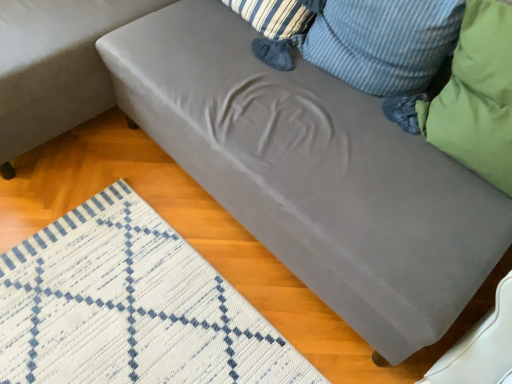
Question: Should I look upward or downward to see green fabric pillow at upper right, positioned as the second pillow in right-to-left order?

Choices:
 (A) up
 (B) down

Answer: (A)

Question: Is green fabric pillow at upper right, positioned as the second pillow in right-to-left order, to the right of satin gray couch at lower right from the viewer's perspective?

Choices:
 (A) yes
 (B) no

Answer: (A)

Question: From a real-world perspective, is green fabric pillow at upper right, acting as the 1th pillow starting from the left, over satin gray couch at lower right?

Choices:
 (A) no
 (B) yes

Answer: (B)

Question: Considering the relative sizes of green fabric pillow at upper right, acting as the 1th pillow starting from the left, and satin gray couch at lower right in the image provided, is green fabric pillow at upper right, acting as the 1th pillow starting from the left, smaller than satin gray couch at lower right?

Choices:
 (A) yes
 (B) no

Answer: (A)

Question: Is green fabric pillow at upper right, acting as the 1th pillow starting from the left, thinner than satin gray couch at lower right?

Choices:
 (A) no
 (B) yes

Answer: (B)

Question: From the image's perspective, is green fabric pillow at upper right, acting as the 1th pillow starting from the left, located above satin gray couch at lower right?

Choices:
 (A) yes
 (B) no

Answer: (B)

Question: Is satin gray couch at lower right at the back of green fabric pillow at upper right, positioned as the second pillow in right-to-left order?

Choices:
 (A) no
 (B) yes

Answer: (A)

Question: Considering the relative sizes of satin gray couch at lower right and green fabric pillow at upper right, positioned as the second pillow in right-to-left order, in the image provided, is satin gray couch at lower right smaller than green fabric pillow at upper right, positioned as the second pillow in right-to-left order,?

Choices:
 (A) no
 (B) yes

Answer: (A)

Question: From a real-world perspective, is satin gray couch at lower right beneath green fabric pillow at upper right, acting as the 1th pillow starting from the left?

Choices:
 (A) no
 (B) yes

Answer: (B)

Question: Is satin gray couch at lower right not inside green fabric pillow at upper right, acting as the 1th pillow starting from the left?

Choices:
 (A) yes
 (B) no

Answer: (A)

Question: Can you confirm if satin gray couch at lower right is taller than green fabric pillow at upper right, acting as the 1th pillow starting from the left?

Choices:
 (A) yes
 (B) no

Answer: (A)

Question: Is there a large distance between satin gray couch at lower right and green fabric pillow at upper right, positioned as the second pillow in right-to-left order?

Choices:
 (A) yes
 (B) no

Answer: (B)

Question: Is satin gray couch at lower right behind green fabric pillow at upper right, positioned as the second pillow in right-to-left order?

Choices:
 (A) yes
 (B) no

Answer: (A)

Question: Does green fabric pillow at right, which is counted as the 1th pillow, starting from the right, have a lesser height compared to satin gray couch at lower right?

Choices:
 (A) no
 (B) yes

Answer: (B)